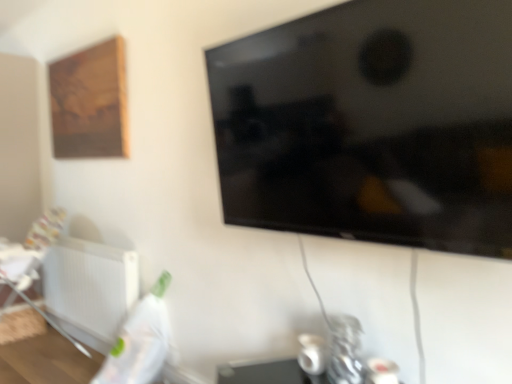
Question: Can you confirm if white plastic radiator at lower left is thinner than wooden picture frame at upper left?

Choices:
 (A) no
 (B) yes

Answer: (A)

Question: Is white plastic radiator at lower left in front of wooden picture frame at upper left?

Choices:
 (A) yes
 (B) no

Answer: (A)

Question: Is white plastic radiator at lower left placed right next to wooden picture frame at upper left?

Choices:
 (A) no
 (B) yes

Answer: (A)

Question: Does white plastic radiator at lower left contain wooden picture frame at upper left?

Choices:
 (A) yes
 (B) no

Answer: (B)

Question: Can you confirm if white plastic radiator at lower left is taller than wooden picture frame at upper left?

Choices:
 (A) yes
 (B) no

Answer: (B)

Question: Is white plastic radiator at lower left not close to wooden picture frame at upper left?

Choices:
 (A) no
 (B) yes

Answer: (A)

Question: Is black glossy tv at upper center thinner than white plastic radiator at lower left?

Choices:
 (A) no
 (B) yes

Answer: (A)

Question: Is black glossy tv at upper center far away from white plastic radiator at lower left?

Choices:
 (A) yes
 (B) no

Answer: (A)

Question: From a real-world perspective, is black glossy tv at upper center beneath white plastic radiator at lower left?

Choices:
 (A) yes
 (B) no

Answer: (B)

Question: Is black glossy tv at upper center with white plastic radiator at lower left?

Choices:
 (A) no
 (B) yes

Answer: (A)

Question: Does black glossy tv at upper center have a larger size compared to white plastic radiator at lower left?

Choices:
 (A) yes
 (B) no

Answer: (A)

Question: Considering the relative sizes of black glossy tv at upper center and white plastic radiator at lower left in the image provided, is black glossy tv at upper center shorter than white plastic radiator at lower left?

Choices:
 (A) yes
 (B) no

Answer: (B)

Question: From the image's perspective, is black glossy tv at upper center on wooden picture frame at upper left?

Choices:
 (A) no
 (B) yes

Answer: (A)